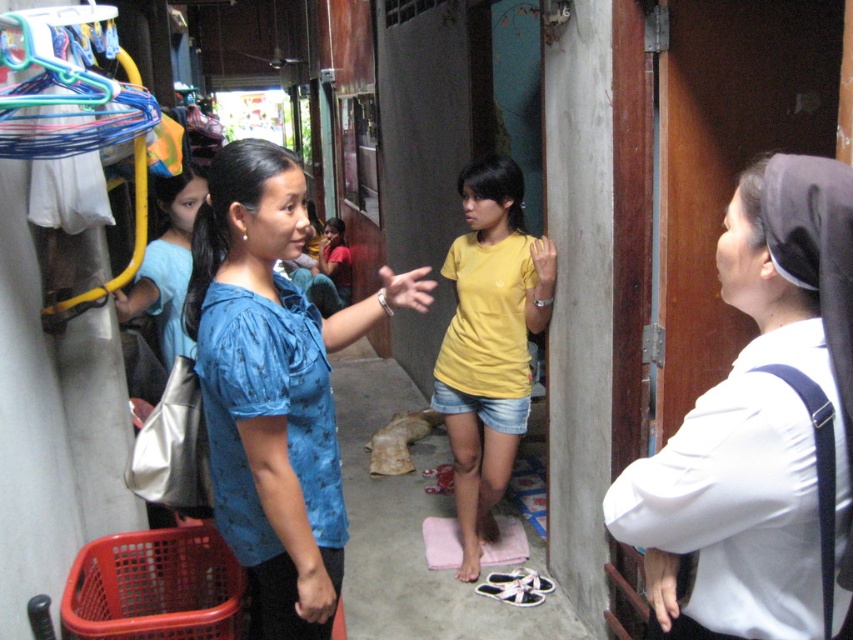
Can you confirm if blue printed blouse at center is positioned to the left of yellow matte shirt at center?

Yes, blue printed blouse at center is to the left of yellow matte shirt at center.

Measure the distance between point [256,161] and camera.

Point [256,161] and camera are 5.25 feet apart from each other.

Who is more forward, (231, 147) or (494, 346)?

Point (231, 147)

Locate an element on the screen. blue printed blouse at center is located at coordinates (274, 387).

Identify the location of white smooth uniform at right. The image size is (853, 640). (757, 426).

Who is positioned more to the left, white smooth uniform at right or yellow matte shirt at center?

Positioned to the left is yellow matte shirt at center.

Which is behind, point (653, 616) or point (537, 314)?

The point (537, 314) is behind.

Find the location of a particular element. The width and height of the screenshot is (853, 640). white smooth uniform at right is located at coordinates (757, 426).

Does point (677, 552) come farther from viewer compared to point (236, 218)?

No, (677, 552) is closer to viewer.

Is point (709, 509) positioned in front of point (352, 305)?

That is True.

The width and height of the screenshot is (853, 640). What are the coordinates of `white smooth uniform at right` in the screenshot? It's located at (757, 426).